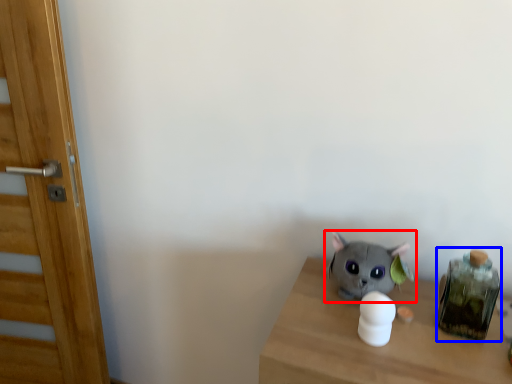
Question: Which object is closer to the camera taking this photo, toy (highlighted by a red box) or glass jar (highlighted by a blue box)?

Choices:
 (A) toy
 (B) glass jar

Answer: (B)